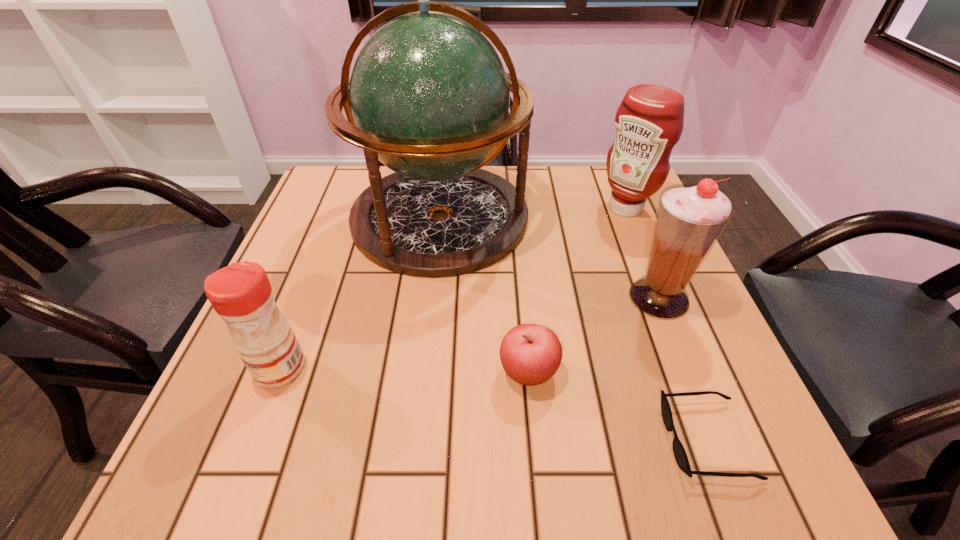
I want to click on free region at the left edge of the desktop, so click(304, 278).

In the image, there is a desktop. Identify the location of free region at the right edge. This screenshot has width=960, height=540. (631, 235).

What are the coordinates of `free space at the far left corner of the desktop` in the screenshot? It's located at (337, 191).

Locate an element on the screen. Image resolution: width=960 pixels, height=540 pixels. free point at the near left corner is located at coordinates (295, 469).

The height and width of the screenshot is (540, 960). Find the location of `vacant area at the far right corner of the desktop`. vacant area at the far right corner of the desktop is located at coordinates (595, 168).

Identify the location of vacant space at the near right corner of the desktop. This screenshot has height=540, width=960. (780, 482).

Where is `vacant region between the shorter condiment and the apple`? The image size is (960, 540). vacant region between the shorter condiment and the apple is located at coordinates (404, 370).

Locate an element on the screen. The height and width of the screenshot is (540, 960). unoccupied area between the right condiment and the nearest object is located at coordinates (666, 324).

Find the location of a particular element. free spot between the farther condiment and the smoothie is located at coordinates (642, 253).

This screenshot has height=540, width=960. In order to click on empty space between the shorter condiment and the sunglasses in this screenshot , I will do 493,404.